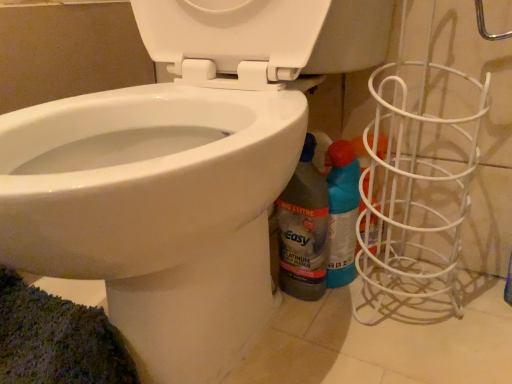
Question: From the image's perspective, does white glossy bidet at lower left appear lower than translucent plastic bottle at lower right, the second cleaning product in the right-to-left sequence?

Choices:
 (A) yes
 (B) no

Answer: (B)

Question: Does white glossy bidet at lower left touch translucent plastic bottle at lower right, the second cleaning product in the right-to-left sequence?

Choices:
 (A) yes
 (B) no

Answer: (B)

Question: Considering the relative sizes of white glossy bidet at lower left and translucent plastic bottle at lower right, the second cleaning product in the right-to-left sequence, in the image provided, is white glossy bidet at lower left thinner than translucent plastic bottle at lower right, the second cleaning product in the right-to-left sequence,?

Choices:
 (A) yes
 (B) no

Answer: (B)

Question: Is translucent plastic bottle at lower right, the second cleaning product in the right-to-left sequence, completely or partially inside white glossy bidet at lower left?

Choices:
 (A) yes
 (B) no

Answer: (A)

Question: Is white glossy bidet at lower left at the left side of translucent plastic bottle at lower right, the first cleaning product in the left-to-right sequence?

Choices:
 (A) yes
 (B) no

Answer: (A)

Question: Does white glossy bidet at lower left have a lesser height compared to translucent plastic bottle at lower right, the second cleaning product in the right-to-left sequence?

Choices:
 (A) yes
 (B) no

Answer: (B)

Question: Is blue glossy spray can at lower right, marked as the second cleaning product in a left-to-right arrangement, at the left side of translucent plastic bottle at lower right, the first cleaning product in the left-to-right sequence?

Choices:
 (A) yes
 (B) no

Answer: (B)

Question: Is blue glossy spray can at lower right, which appears as the 1th cleaning product when viewed from the right, outside translucent plastic bottle at lower right, the second cleaning product in the right-to-left sequence?

Choices:
 (A) no
 (B) yes

Answer: (B)

Question: From a real-world perspective, is blue glossy spray can at lower right, marked as the second cleaning product in a left-to-right arrangement, below translucent plastic bottle at lower right, the second cleaning product in the right-to-left sequence?

Choices:
 (A) yes
 (B) no

Answer: (A)

Question: From a real-world perspective, is blue glossy spray can at lower right, which appears as the 1th cleaning product when viewed from the right, on translucent plastic bottle at lower right, the first cleaning product in the left-to-right sequence?

Choices:
 (A) no
 (B) yes

Answer: (A)

Question: Considering the relative sizes of blue glossy spray can at lower right, which appears as the 1th cleaning product when viewed from the right, and translucent plastic bottle at lower right, the second cleaning product in the right-to-left sequence, in the image provided, is blue glossy spray can at lower right, which appears as the 1th cleaning product when viewed from the right, shorter than translucent plastic bottle at lower right, the second cleaning product in the right-to-left sequence,?

Choices:
 (A) yes
 (B) no

Answer: (A)

Question: Does blue glossy spray can at lower right, which appears as the 1th cleaning product when viewed from the right, have a smaller size compared to translucent plastic bottle at lower right, the second cleaning product in the right-to-left sequence?

Choices:
 (A) no
 (B) yes

Answer: (A)

Question: Can you confirm if blue glossy spray can at lower right, which appears as the 1th cleaning product when viewed from the right, is positioned to the left of white glossy bidet at lower left?

Choices:
 (A) yes
 (B) no

Answer: (B)